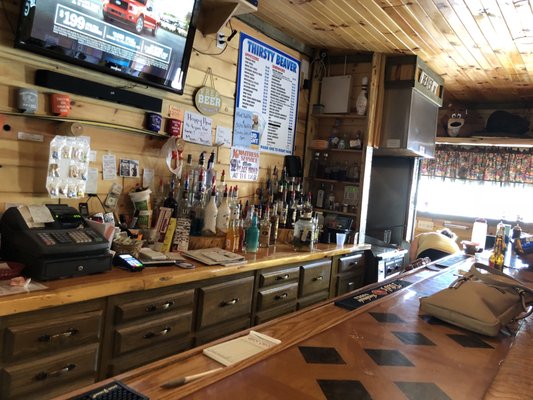
Where is `countertop`? countertop is located at coordinates (193, 269), (329, 374).